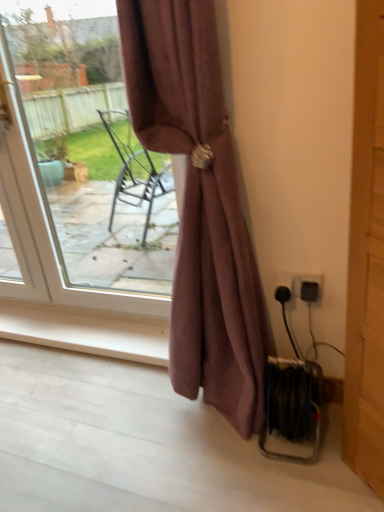
Question: From a real-world perspective, is black plastic electric outlet at lower right, acting as the first electric outlet starting from the right, physically located above or below wooden door at right?

Choices:
 (A) above
 (B) below

Answer: (B)

Question: From the image's perspective, relative to wooden door at right, is black plastic electric outlet at lower right, which is counted as the second electric outlet, starting from the left, above or below?

Choices:
 (A) above
 (B) below

Answer: (B)

Question: Based on their relative distances, which object is farther from the mauve fabric curtain at center?

Choices:
 (A) black plastic socket at lower right, the first electric outlet when ordered from left to right
 (B) matte white door at upper left
 (C) black plastic electric outlet at lower right, acting as the first electric outlet starting from the right
 (D) wooden door at right

Answer: (B)

Question: Based on their relative distances, which object is nearer to the black plastic electric outlet at lower right, which is counted as the second electric outlet, starting from the left?

Choices:
 (A) wooden door at right
 (B) black plastic socket at lower right, placed as the 2th electric outlet when sorted from right to left
 (C) matte white door at upper left
 (D) mauve fabric curtain at center

Answer: (B)